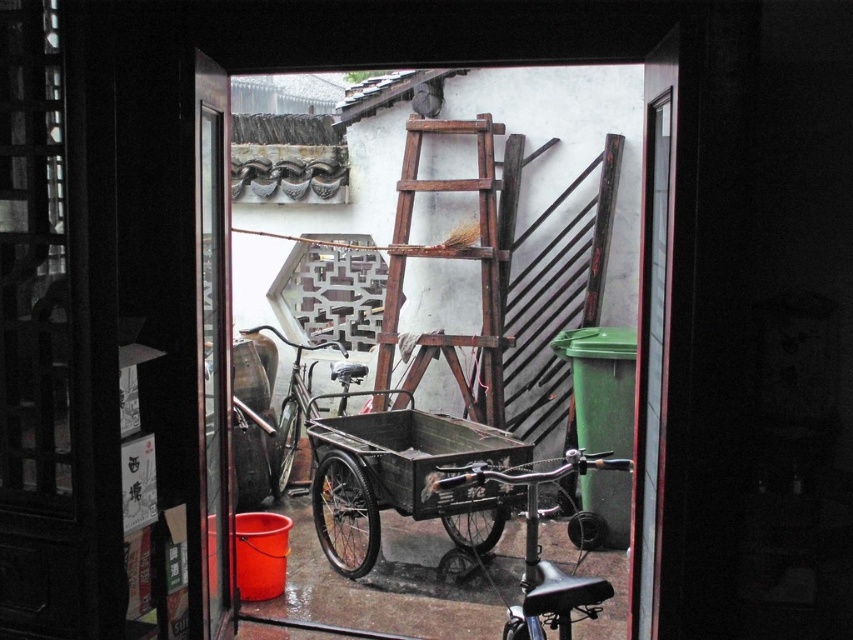
Between wooden rustic ladder at center and shiny metallic bicycle at center, which one appears on the left side from the viewer's perspective?

Positioned to the left is shiny metallic bicycle at center.

The height and width of the screenshot is (640, 853). What are the coordinates of `wooden rustic ladder at center` in the screenshot? It's located at (448, 257).

Locate an element on the screen. This screenshot has height=640, width=853. wooden rustic ladder at center is located at coordinates (448, 257).

Who is more distant from viewer, (577, 582) or (296, 387)?

Point (296, 387)

Is shiny black bicycle at center further to the viewer compared to shiny metallic bicycle at center?

That is False.

Between point (527, 504) and point (286, 406), which one is positioned behind?

Positioned behind is point (286, 406).

Find the location of a particular element. The width and height of the screenshot is (853, 640). shiny black bicycle at center is located at coordinates (538, 550).

Looking at this image, can you confirm if black matte cart at center is positioned above shiny metallic bicycle at center?

No.

Is black matte cart at center bigger than shiny metallic bicycle at center?

Indeed, black matte cart at center has a larger size compared to shiny metallic bicycle at center.

Between point (363, 508) and point (277, 422), which one is positioned behind?

The point (277, 422) is more distant.

The height and width of the screenshot is (640, 853). In order to click on black matte cart at center in this screenshot , I will do `click(404, 476)`.